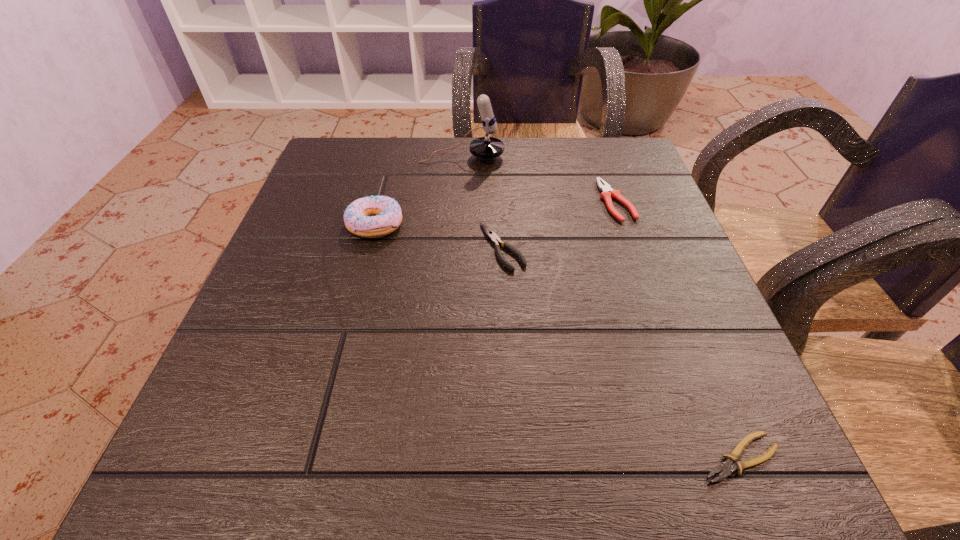
Where is `free space located 0.070m on the front of the farthest pliers`? The width and height of the screenshot is (960, 540). free space located 0.070m on the front of the farthest pliers is located at coordinates (633, 247).

Find the location of a particular element. vacant space located 0.140m on the back of the second farthest pliers is located at coordinates (499, 185).

At what (x,y) coordinates should I click in order to perform the action: click on free space located on the left of the shortest object. Please return your answer as a coordinate pair (x, y). The height and width of the screenshot is (540, 960). Looking at the image, I should click on (652, 457).

Where is `microphone located at the far edge`? microphone located at the far edge is located at coordinates click(486, 147).

Image resolution: width=960 pixels, height=540 pixels. I want to click on pliers that is positioned at the far edge, so coord(607,192).

Where is `object that is at the near edge`? Image resolution: width=960 pixels, height=540 pixels. object that is at the near edge is located at coordinates [x=726, y=467].

Find the location of a particular element. The image size is (960, 540). object present at the left edge is located at coordinates (357, 219).

Locate an element on the screen. The height and width of the screenshot is (540, 960). object located at the far right corner is located at coordinates (607, 192).

The width and height of the screenshot is (960, 540). I want to click on object that is at the near right corner, so click(726, 467).

Find the location of a particular element. The width and height of the screenshot is (960, 540). free space at the far edge of the desktop is located at coordinates (424, 193).